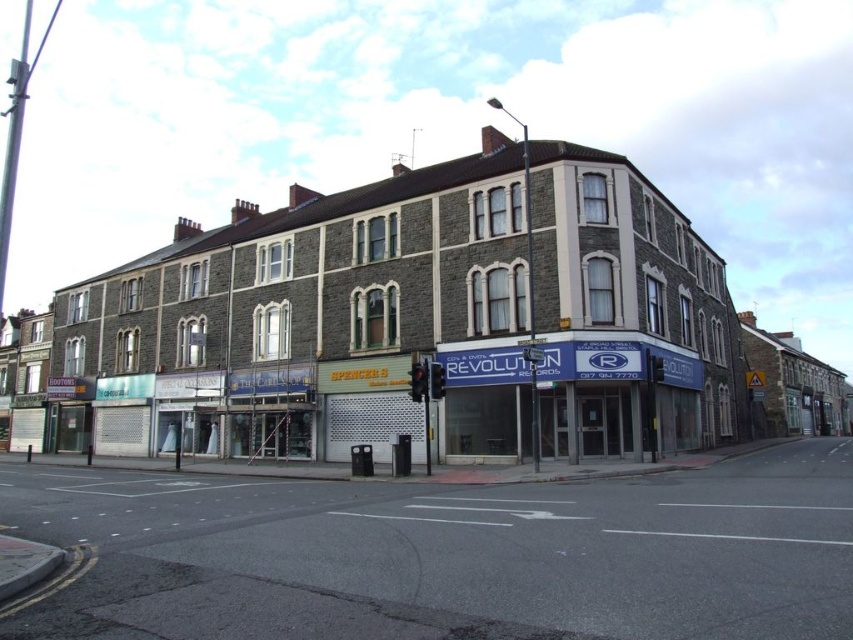
You are standing at the street corner and want to locate the stone building at center. What are the coordinates where you can find it?

The stone building at center can be found at coordinates point (413, 317).